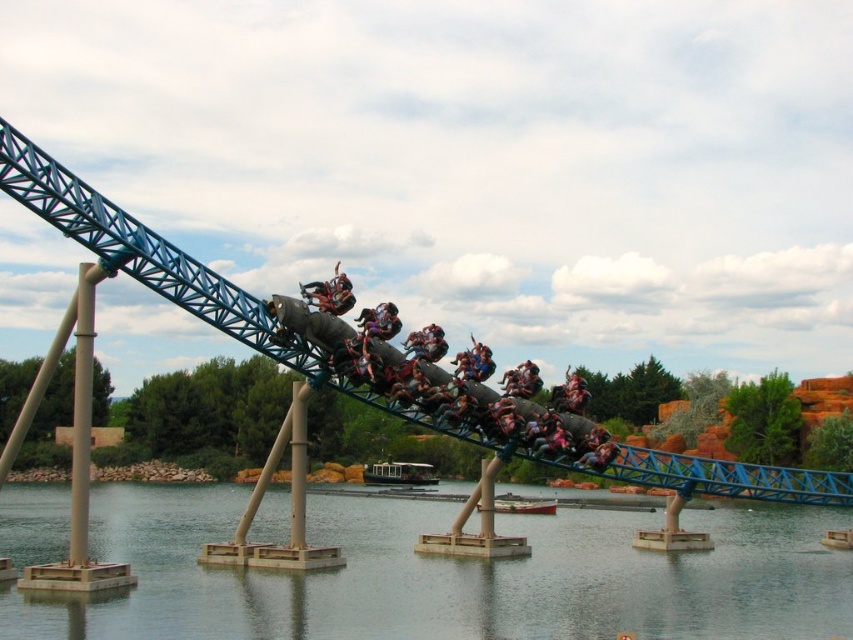
Question: Considering the relative positions of transparent glass water at lower center and metallic silver roller coaster car at center in the image provided, where is transparent glass water at lower center located with respect to metallic silver roller coaster car at center?

Choices:
 (A) below
 (B) above

Answer: (A)

Question: Can you confirm if transparent glass water at lower center is bigger than metallic gray roller coaster car at center?

Choices:
 (A) no
 (B) yes

Answer: (B)

Question: Can you confirm if transparent glass water at lower center is smaller than metallic silver roller coaster car at center?

Choices:
 (A) no
 (B) yes

Answer: (A)

Question: Which object is farther from the camera taking this photo?

Choices:
 (A) metallic gray roller coaster car at center
 (B) transparent glass water at lower center
 (C) metallic silver roller coaster car at center

Answer: (A)

Question: Which of the following is the farthest from the observer?

Choices:
 (A) [523, 589]
 (B) [328, 289]

Answer: (B)

Question: Which of the following is the closest to the observer?

Choices:
 (A) pos(368,348)
 (B) pos(318,298)

Answer: (B)